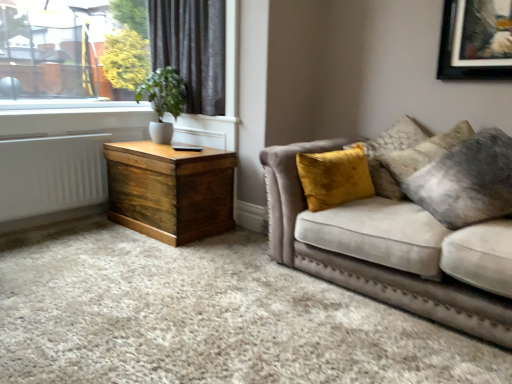
Describe the element at coordinates (392, 251) in the screenshot. This screenshot has width=512, height=384. I see `velvet beige couch at right` at that location.

Identify the location of white painted radiator at left. (51, 174).

The image size is (512, 384). What do you see at coordinates (163, 92) in the screenshot? I see `green matte plant at upper left` at bounding box center [163, 92].

The width and height of the screenshot is (512, 384). What do you see at coordinates (205, 317) in the screenshot? I see `velvet beige sofa at right` at bounding box center [205, 317].

Locate an element on the screen. The height and width of the screenshot is (384, 512). dark grey velvet curtain at upper left is located at coordinates (191, 49).

At what (x,y) coordinates should I click in order to perform the action: click on velvet beige couch at right. Please return your answer as a coordinate pair (x, y). Looking at the image, I should click on (392, 251).

Is velvet beige couch at right far away from velvet beige sofa at right?

velvet beige couch at right is near velvet beige sofa at right, not far away.

Is velvet beige couch at right turned away from velvet beige sofa at right?

No.

Considering the relative positions of velvet beige couch at right and velvet beige sofa at right in the image provided, is velvet beige couch at right behind velvet beige sofa at right?

Yes, velvet beige couch at right is further from the viewer.

Is velvet beige sofa at right oriented towards white painted radiator at left?

No, velvet beige sofa at right is not aimed at white painted radiator at left.

From the image's perspective, is velvet beige sofa at right located beneath white painted radiator at left?

Yes, from the image's perspective, velvet beige sofa at right is below white painted radiator at left.

Which point is more forward, (213, 344) or (71, 171)?

Point (213, 344)

Considering the relative sizes of velvet beige sofa at right and white painted radiator at left in the image provided, is velvet beige sofa at right shorter than white painted radiator at left?

Correct, velvet beige sofa at right is not as tall as white painted radiator at left.

Considering the sizes of objects velvet yellow pillow at right and green matte plant at upper left in the image provided, who is bigger, velvet yellow pillow at right or green matte plant at upper left?

Bigger between the two is velvet yellow pillow at right.

Considering their positions, is velvet yellow pillow at right located in front of or behind green matte plant at upper left?

Visually, velvet yellow pillow at right is located in front of green matte plant at upper left.

Identify the location of pillow that appears below the green matte plant at upper left (from the image's perspective). (467, 181).

Consider the image. How many degrees apart are the facing directions of velvet yellow pillow at right and green matte plant at upper left?

velvet yellow pillow at right and green matte plant at upper left are facing 22.1 degrees away from each other.

Considering their positions, is green matte plant at upper left located in front of or behind velvet beige sofa at right?

green matte plant at upper left is behind velvet beige sofa at right.

From the image's perspective, which is below, green matte plant at upper left or velvet beige sofa at right?

velvet beige sofa at right.

Can you confirm if green matte plant at upper left is smaller than velvet beige sofa at right?

Yes, green matte plant at upper left is smaller than velvet beige sofa at right.

Is green matte plant at upper left not inside velvet beige sofa at right?

Yes, green matte plant at upper left is outside of velvet beige sofa at right.

Is green matte plant at upper left in contact with velvet yellow pillow at right?

No, green matte plant at upper left is not making contact with velvet yellow pillow at right.

Considering the relative sizes of green matte plant at upper left and velvet yellow pillow at right in the image provided, is green matte plant at upper left thinner than velvet yellow pillow at right?

No, green matte plant at upper left is not thinner than velvet yellow pillow at right.

Does green matte plant at upper left turn towards velvet yellow pillow at right?

No, green matte plant at upper left is not facing towards velvet yellow pillow at right.

What's the angular difference between green matte plant at upper left and velvet yellow pillow at right's facing directions?

green matte plant at upper left and velvet yellow pillow at right are facing 22.1 degrees away from each other.

Is point (78, 177) positioned before point (505, 307)?

No.

In the image, is white painted radiator at left positioned in front of or behind velvet beige couch at right?

Clearly, white painted radiator at left is behind velvet beige couch at right.

From the image's perspective, is white painted radiator at left located above or below velvet beige couch at right?

white painted radiator at left is above velvet beige couch at right.

You are a GUI agent. You are given a task and a screenshot of the screen. Output one action in this format:
    pyautogui.click(x=<x>, y=<y>)
    Task: Click on the studio couch below the white painted radiator at left (from a real-world perspective)
    This screenshot has width=512, height=384.
    Given the screenshot: What is the action you would take?
    pos(392,251)

From a real-world perspective, is velvet beige couch at right on top of dark grey velvet curtain at upper left?

No, from a real-world perspective, velvet beige couch at right is not above dark grey velvet curtain at upper left.

Which is correct: velvet beige couch at right is inside dark grey velvet curtain at upper left, or outside of it?

velvet beige couch at right is located beyond the bounds of dark grey velvet curtain at upper left.

Considering the relative sizes of velvet beige couch at right and dark grey velvet curtain at upper left in the image provided, is velvet beige couch at right taller than dark grey velvet curtain at upper left?

In fact, velvet beige couch at right may be shorter than dark grey velvet curtain at upper left.

Between point (349, 238) and point (224, 76), which one is positioned behind?

Positioned behind is point (224, 76).

Image resolution: width=512 pixels, height=384 pixels. In order to click on plain that is under the velvet beige couch at right (from a real-world perspective) in this screenshot , I will do `click(205, 317)`.

At what (x,y) coordinates should I click in order to perform the action: click on radiator on the left of velvet beige sofa at right. Please return your answer as a coordinate pair (x, y). Looking at the image, I should click on (51, 174).

When comparing their distances from wooden trunk at left, does white painted radiator at left or green matte plant at upper left seem closer?

The object closer to wooden trunk at left is white painted radiator at left.

Based on their spatial positions, is green matte plant at upper left or velvet yellow pillow at right closer to velvet beige couch at right?

Based on the image, velvet yellow pillow at right appears to be nearer to velvet beige couch at right.

Based on their spatial positions, is green matte plant at upper left or dark grey velvet curtain at upper left further from velvet beige sofa at right?

green matte plant at upper left is positioned further to the anchor velvet beige sofa at right.

Estimate the real-world distances between objects in this image. Which object is closer to green matte plant at upper left, wooden trunk at left or white painted radiator at left?

wooden trunk at left.

Based on the photo, estimate the real-world distances between objects in this image. Which object is closer to velvet beige couch at right, velvet yellow pillow at right or white painted radiator at left?

velvet yellow pillow at right lies closer to velvet beige couch at right than the other object.

When comparing their distances from green matte plant at upper left, does wooden trunk at left or dark grey velvet curtain at upper left seem closer?

dark grey velvet curtain at upper left.

Estimate the real-world distances between objects in this image. Which object is closer to velvet beige couch at right, wooden trunk at left or dark grey velvet curtain at upper left?

wooden trunk at left.

Based on their spatial positions, is green matte plant at upper left or dark grey velvet curtain at upper left closer to velvet yellow pillow at right?

dark grey velvet curtain at upper left.

Find the location of a particular element. Image resolution: width=512 pixels, height=384 pixels. curtain between velvet beige sofa at right and green matte plant at upper left along the z-axis is located at coordinates (191, 49).

Locate an element on the screen. The image size is (512, 384). studio couch situated between dark grey velvet curtain at upper left and velvet yellow pillow at right from left to right is located at coordinates (392, 251).

Locate an element on the screen. curtain between green matte plant at upper left and velvet yellow pillow at right from left to right is located at coordinates (191, 49).

Image resolution: width=512 pixels, height=384 pixels. Find the location of `pillow between velvet beige sofa at right and green matte plant at upper left in the front-back direction`. pillow between velvet beige sofa at right and green matte plant at upper left in the front-back direction is located at coordinates (467, 181).